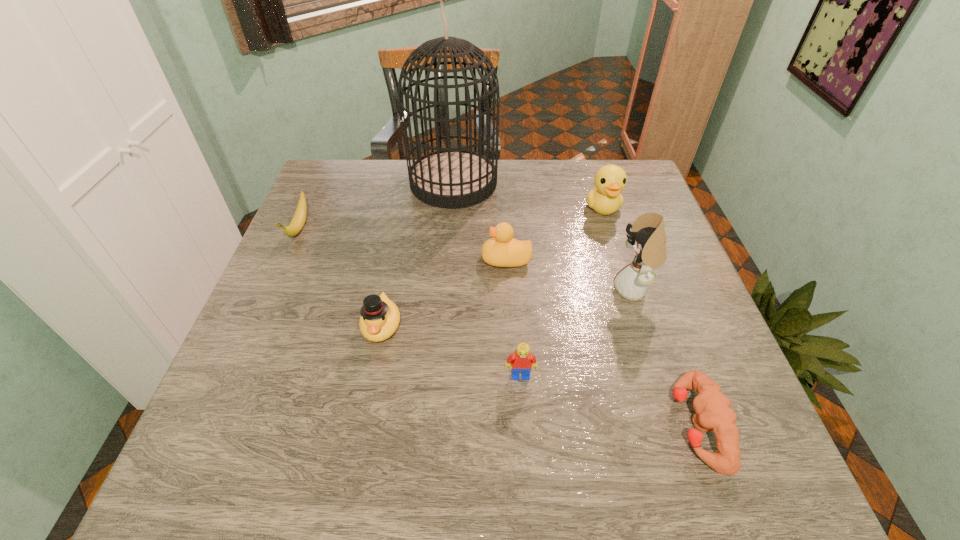
The image size is (960, 540). I want to click on object present at the far right corner, so click(605, 198).

Locate an element on the screen. object present at the near right corner is located at coordinates (713, 413).

Image resolution: width=960 pixels, height=540 pixels. I want to click on free space at the far edge of the desktop, so click(537, 183).

At what (x,y) coordinates should I click in order to perform the action: click on free region at the near edge of the desktop. Please return your answer as a coordinate pair (x, y). This screenshot has width=960, height=540. Looking at the image, I should click on (628, 455).

This screenshot has width=960, height=540. Identify the location of free space at the left edge. (x=289, y=321).

At what (x,y) coordinates should I click in order to perform the action: click on free space at the right edge. Please return your answer as a coordinate pair (x, y). Looking at the image, I should click on (691, 333).

Where is `free space at the far left corner`? The image size is (960, 540). free space at the far left corner is located at coordinates pyautogui.click(x=330, y=184).

Image resolution: width=960 pixels, height=540 pixels. In the image, there is a desktop. In order to click on blank space at the near left corner in this screenshot , I will do `click(199, 472)`.

This screenshot has width=960, height=540. I want to click on free space at the near right corner, so click(697, 473).

Find the location of a particular element. This screenshot has width=960, height=540. free space between the second tallest object and the Lego is located at coordinates (577, 333).